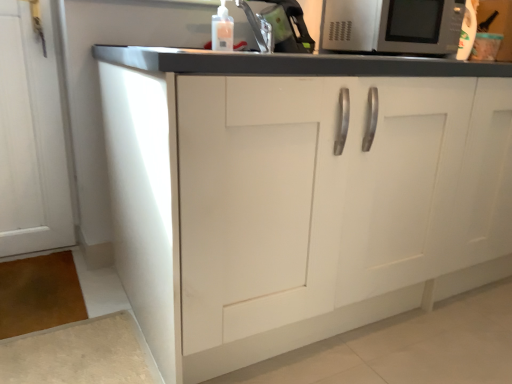
Locate an element on the screen. This screenshot has height=384, width=512. unoccupied region to the right of translucent plastic bottle at upper center is located at coordinates (257, 49).